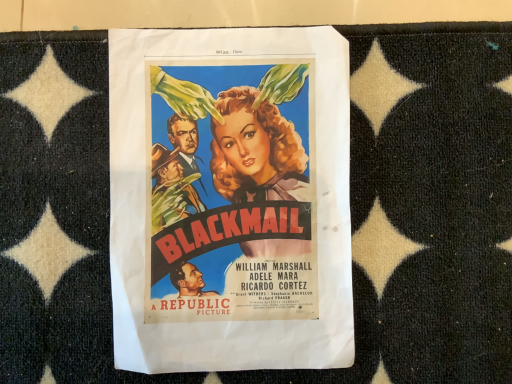
The width and height of the screenshot is (512, 384). In order to click on matte paper poster at center in this screenshot , I will do `click(230, 199)`.

Measure the distance between point (121, 336) and camera.

36.80 centimeters.

In order to face matte paper poster at center, should I rotate leftwards or rightwards?

To align with it, rotate left about 3.545°.

What do you see at coordinates (230, 199) in the screenshot?
I see `matte paper poster at center` at bounding box center [230, 199].

Find the location of a particular element. The image size is (512, 384). matte paper poster at center is located at coordinates (230, 199).